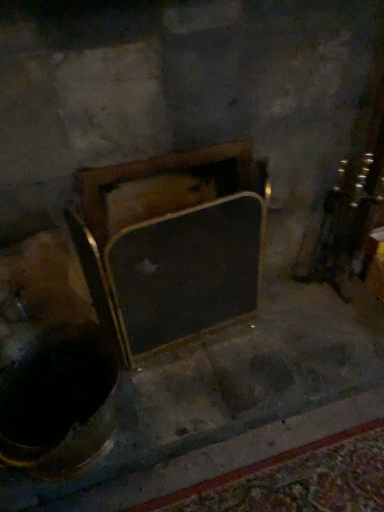
Find the location of a particular element. free space to the right of metallic gold frame at center is located at coordinates (285, 342).